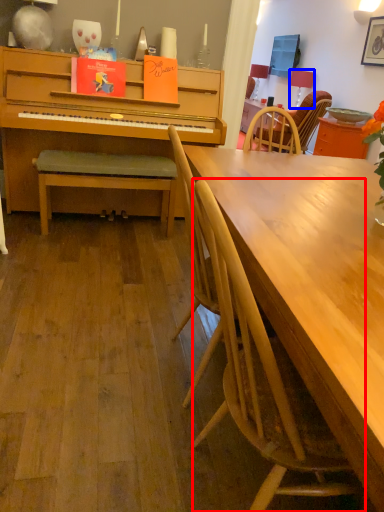
Question: Which object is further to the camera taking this photo, chair (highlighted by a red box) or lamp (highlighted by a blue box)?

Choices:
 (A) chair
 (B) lamp

Answer: (B)